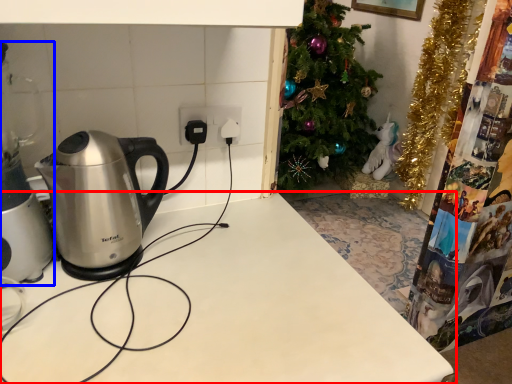
Question: Which object is further to the camera taking this photo, table (highlighted by a red box) or appliance (highlighted by a blue box)?

Choices:
 (A) table
 (B) appliance

Answer: (B)